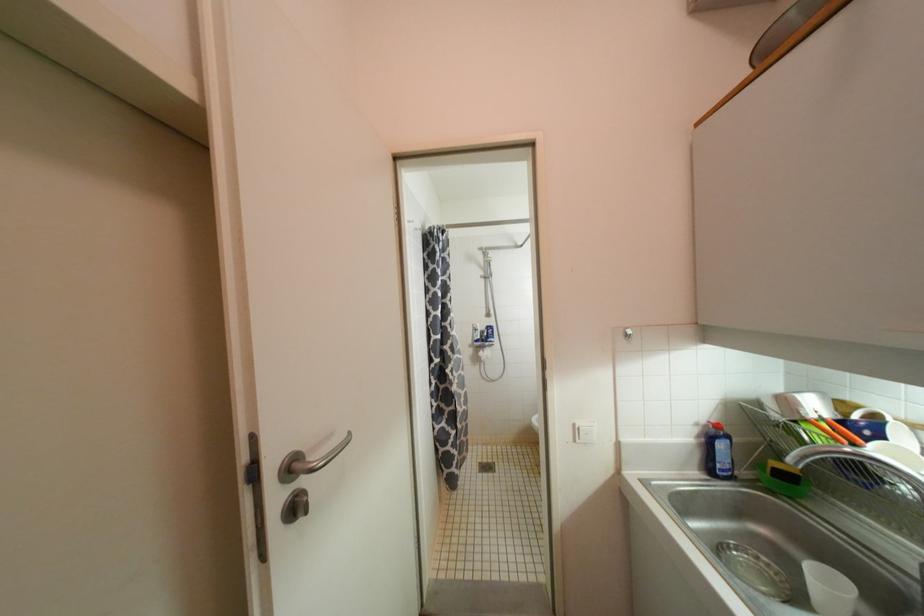
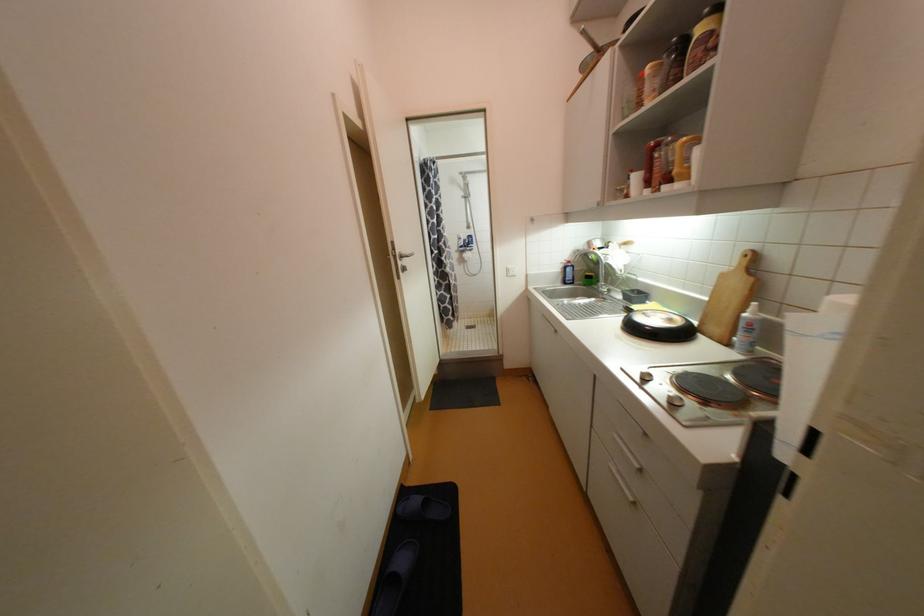
In the second image, find the point that corresponds to (259,464) in the first image.

(398, 251)